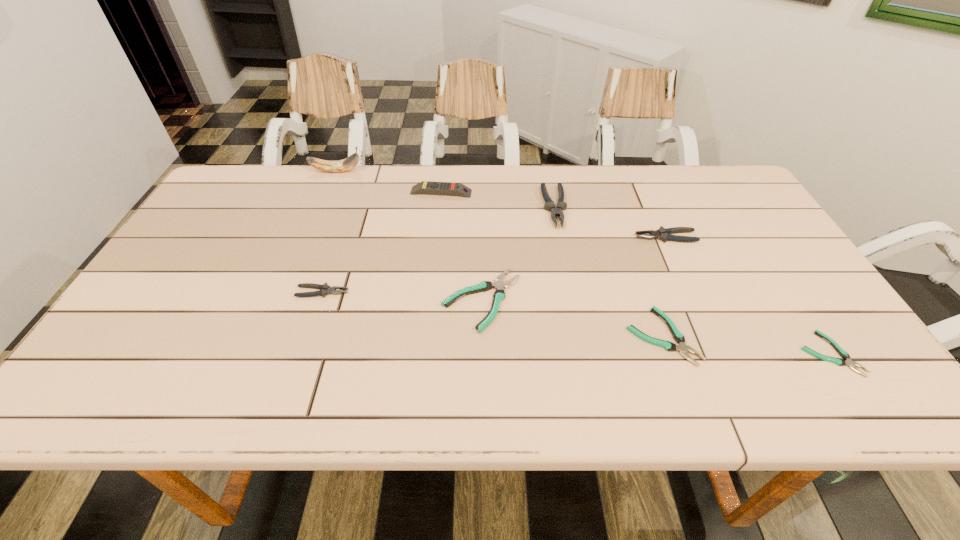
I want to click on free space that is in between the third pliers from left to right and the leftmost gray pliers, so click(x=439, y=249).

Locate an element on the screen. The image size is (960, 540). free space between the second shortest object and the fifth nearest pliers is located at coordinates (663, 287).

Image resolution: width=960 pixels, height=540 pixels. I want to click on free space between the tallest object and the second teal pliers from left to right, so click(x=499, y=254).

Where is `free space between the remote control and the farthest object`? The width and height of the screenshot is (960, 540). free space between the remote control and the farthest object is located at coordinates (389, 181).

Identify the location of empty location between the smallest teal pliers and the tallest pliers. (692, 280).

Point out which object is positioned as the seventh nearest to the yellow remote control. Please provide its 2D coordinates. Your answer should be formatted as a tuple, i.e. [(x, y)], where the tuple contains the x and y coordinates of a point satisfying the conditions above.

[(840, 362)]

This screenshot has height=540, width=960. I want to click on object that is the fifth closest to the second gray pliers from right to left, so click(325, 289).

Locate which pliers is the closest to the fourth tallest pliers. Please provide its 2D coordinates. Your answer should be formatted as a tuple, i.e. [(x, y)], where the tuple contains the x and y coordinates of a point satisfying the conditions above.

[(549, 205)]

This screenshot has height=540, width=960. What are the coordinates of `pliers that is the closest to the third shortest pliers` in the screenshot? It's located at (549, 205).

The image size is (960, 540). I want to click on gray pliers that can be found as the second closest to the fifth shortest object, so click(x=325, y=289).